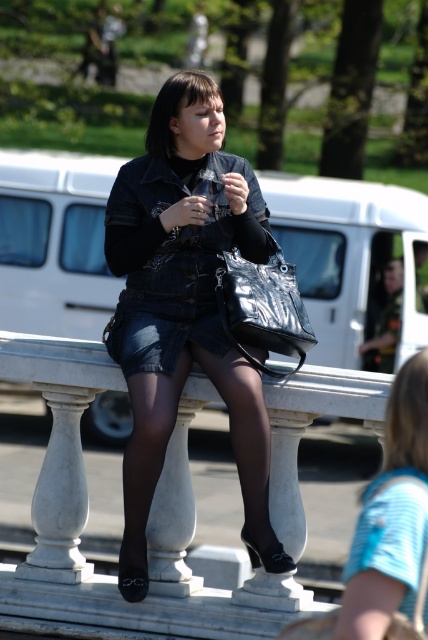
The woman is wearing two items at the center of the image. Which item has a greater width between the black tights at center and the denim shorts at center?

The black tights at center has a greater width than the denim shorts at center.

You are standing at the point labeled as point [165,452] in the image. What object are you standing on?

You are standing on the black tights at center.